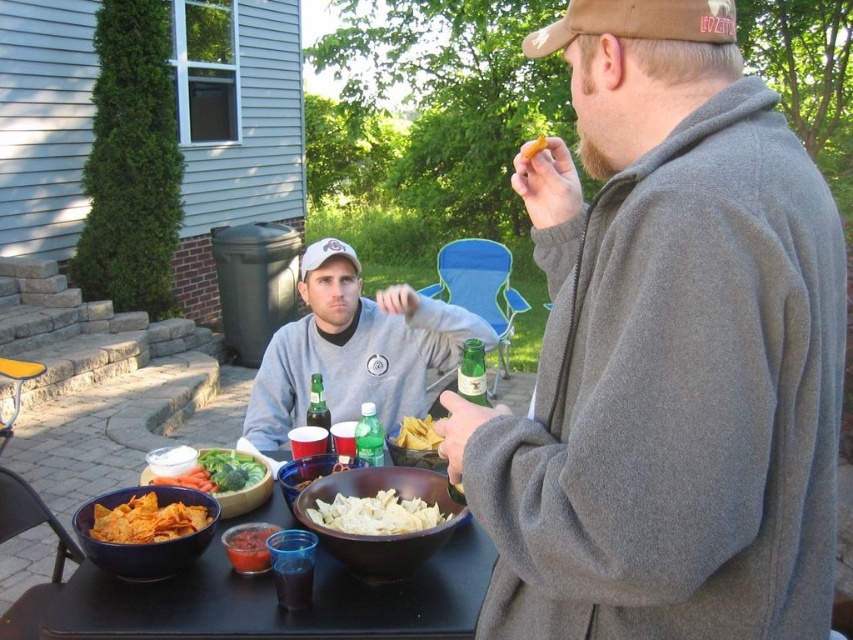
Question: Which object is the farthest from the yellow plastic picnic table at lower left?

Choices:
 (A) gray fleece sweatshirt at center
 (B) gray fleece jacket at upper right
 (C) yellow tortilla chips at center

Answer: (B)

Question: In this image, where is gray fleece jacket at upper right located relative to matte brown bowl at center?

Choices:
 (A) below
 (B) above

Answer: (B)

Question: Can you confirm if white matte chips at center is positioned to the left of matte orange tortilla chips at lower left?

Choices:
 (A) yes
 (B) no

Answer: (B)

Question: Does gray fleece jacket at upper right have a greater width compared to fresh green broccoli at center?

Choices:
 (A) no
 (B) yes

Answer: (B)

Question: Considering the real-world distances, which object is farthest from the yellow tortilla chips at center?

Choices:
 (A) matte brown bowl at center
 (B) white matte chips at center

Answer: (A)

Question: Among these objects, which one is farthest from the camera?

Choices:
 (A) gray fleece sweatshirt at center
 (B) fresh green broccoli at center
 (C) matte brown bowl at center
 (D) gray fleece jacket at upper right

Answer: (A)